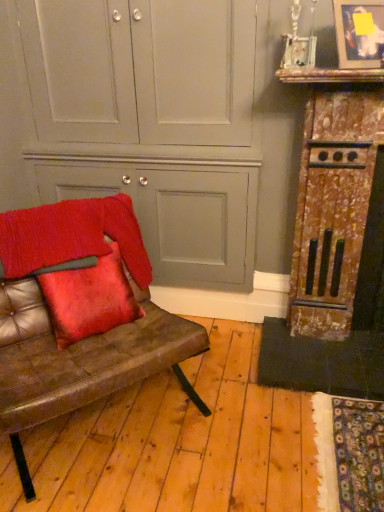
What do you see at coordinates (359, 33) in the screenshot? Image resolution: width=384 pixels, height=512 pixels. I see `metallic silver picture frame at upper right` at bounding box center [359, 33].

At what (x,y) coordinates should I click in order to perform the action: click on metallic silver picture frame at upper right. Please return your answer as a coordinate pair (x, y). Looking at the image, I should click on (359, 33).

The height and width of the screenshot is (512, 384). Describe the element at coordinates (79, 314) in the screenshot. I see `leather couch at left` at that location.

Find the location of a particular element. Image resolution: width=384 pixels, height=512 pixels. velvet red pillow at left is located at coordinates (89, 298).

How much space does rusty metal fireplace at right, which ranks as the second dresser in left-to-right order, occupy vertically?

rusty metal fireplace at right, which ranks as the second dresser in left-to-right order, is 3.92 feet tall.

This screenshot has height=512, width=384. In order to click on metallic silver picture frame at upper right in this screenshot , I will do `click(359, 33)`.

Between velvety red blanket at left and rusty metal fireplace at right, marked as the first dresser in a right-to-left arrangement, which one has more height?

Standing taller between the two is rusty metal fireplace at right, marked as the first dresser in a right-to-left arrangement.

Is velvety red blanket at left oriented towards rusty metal fireplace at right, which ranks as the second dresser in left-to-right order?

No, velvety red blanket at left does not turn towards rusty metal fireplace at right, which ranks as the second dresser in left-to-right order.

Does velvety red blanket at left come in front of rusty metal fireplace at right, marked as the first dresser in a right-to-left arrangement?

Yes, it is in front of rusty metal fireplace at right, marked as the first dresser in a right-to-left arrangement.

Who is taller, leather couch at left or velvety red blanket at left?

leather couch at left is taller.

From the image's perspective, is leather couch at left located above velvety red blanket at left?

Incorrect, from the image's perspective, leather couch at left is lower than velvety red blanket at left.

Consider the image. Relative to velvety red blanket at left, is leather couch at left in front or behind?

leather couch at left is in front of velvety red blanket at left.

Based on the photo, from a real-world perspective, is leather couch at left positioned above or below velvety red blanket at left?

From a real-world perspective, leather couch at left is physically below velvety red blanket at left.

Would you consider velvety red blanket at left to be distant from leather couch at left?

No.

From the image's perspective, is velvety red blanket at left above or below leather couch at left?

Based on their image positions, velvety red blanket at left is located above leather couch at left.

Is velvety red blanket at left turned away from leather couch at left?

Correct, velvety red blanket at left is looking away from leather couch at left.

Considering the positions of objects velvety red blanket at left and leather couch at left in the image provided, who is more to the left, velvety red blanket at left or leather couch at left?

velvety red blanket at left.

Are metallic silver picture frame at upper right and rusty metal fireplace at right, which ranks as the second dresser in left-to-right order, far apart?

They are positioned close to each other.

Can you confirm if metallic silver picture frame at upper right is taller than rusty metal fireplace at right, which ranks as the second dresser in left-to-right order?

In fact, metallic silver picture frame at upper right may be shorter than rusty metal fireplace at right, which ranks as the second dresser in left-to-right order.

From the image's perspective, is metallic silver picture frame at upper right over rusty metal fireplace at right, which ranks as the second dresser in left-to-right order?

Yes, from the image's perspective, metallic silver picture frame at upper right is above rusty metal fireplace at right, which ranks as the second dresser in left-to-right order.

Which object is wider, rusty metal fireplace at right, marked as the first dresser in a right-to-left arrangement, or leather couch at left?

Wider between the two is leather couch at left.

Based on the photo, is rusty metal fireplace at right, marked as the first dresser in a right-to-left arrangement, inside or outside of leather couch at left?

rusty metal fireplace at right, marked as the first dresser in a right-to-left arrangement, is spatially situated outside leather couch at left.

Looking at the image, does rusty metal fireplace at right, which ranks as the second dresser in left-to-right order, seem bigger or smaller compared to leather couch at left?

rusty metal fireplace at right, which ranks as the second dresser in left-to-right order, is smaller than leather couch at left.

The width and height of the screenshot is (384, 512). I want to click on studio couch below the rusty metal fireplace at right, which ranks as the second dresser in left-to-right order (from the image's perspective), so (79, 314).

Is metallic silver picture frame at upper right inside or outside of velvety red blanket at left?

metallic silver picture frame at upper right lies outside velvety red blanket at left.

You are a GUI agent. You are given a task and a screenshot of the screen. Output one action in this format:
    pyautogui.click(x=<x>, y=<y>)
    Task: Click on the picture frame above the velvety red blanket at left (from a real-world perspective)
    The image size is (384, 512).
    Given the screenshot: What is the action you would take?
    pyautogui.click(x=359, y=33)

Does point (382, 21) come behind point (130, 200)?

No.

Between matte gray cabinet at center, placed as the first dresser when sorted from left to right, and metallic silver picture frame at upper right, which one is positioned in front?

metallic silver picture frame at upper right is closer to the camera.

From a real-world perspective, between matte gray cabinet at center, placed as the first dresser when sorted from left to right, and metallic silver picture frame at upper right, who is vertically higher?

From a 3D spatial view, metallic silver picture frame at upper right is above.

Does matte gray cabinet at center, placed as the first dresser when sorted from left to right, have a greater width compared to metallic silver picture frame at upper right?

Yes.

Which is closer to the camera, (x=177, y=70) or (x=371, y=9)?

The point (x=371, y=9) is in front.

Where is `blanket below the rusty metal fireplace at right, marked as the first dresser in a right-to-left arrangement (from the image's perspective)`? The height and width of the screenshot is (512, 384). blanket below the rusty metal fireplace at right, marked as the first dresser in a right-to-left arrangement (from the image's perspective) is located at coordinates (72, 236).

This screenshot has height=512, width=384. In order to click on blanket that appears on the left of leather couch at left in this screenshot , I will do `click(72, 236)`.

Considering their positions, is metallic silver picture frame at upper right positioned closer to matte gray cabinet at center, which appears as the second dresser when viewed from the right, than velvet red pillow at left?

The object closer to matte gray cabinet at center, which appears as the second dresser when viewed from the right, is velvet red pillow at left.

Based on their spatial positions, is leather couch at left or metallic silver picture frame at upper right closer to rusty metal fireplace at right, which ranks as the second dresser in left-to-right order?

The object closer to rusty metal fireplace at right, which ranks as the second dresser in left-to-right order, is metallic silver picture frame at upper right.

Which object lies further to the anchor point metallic silver picture frame at upper right, rusty metal fireplace at right, which ranks as the second dresser in left-to-right order, or velvety red blanket at left?

The object further to metallic silver picture frame at upper right is velvety red blanket at left.

Based on the photo, considering their positions, is velvet red pillow at left positioned further to metallic silver picture frame at upper right than velvety red blanket at left?

Among the two, velvet red pillow at left is located further to metallic silver picture frame at upper right.

Considering their positions, is metallic silver picture frame at upper right positioned further to velvety red blanket at left than leather couch at left?

metallic silver picture frame at upper right is further to velvety red blanket at left.

Which object lies further to the anchor point matte gray cabinet at center, which appears as the second dresser when viewed from the right, velvet red pillow at left or rusty metal fireplace at right, marked as the first dresser in a right-to-left arrangement?

velvet red pillow at left is further to matte gray cabinet at center, which appears as the second dresser when viewed from the right.

Looking at the image, which one is located further to metallic silver picture frame at upper right, leather couch at left or velvety red blanket at left?

leather couch at left is further to metallic silver picture frame at upper right.

Estimate the real-world distances between objects in this image. Which object is closer to rusty metal fireplace at right, which ranks as the second dresser in left-to-right order, velvety red blanket at left or leather couch at left?

velvety red blanket at left lies closer to rusty metal fireplace at right, which ranks as the second dresser in left-to-right order, than the other object.

Where is `studio couch located between velvety red blanket at left and rusty metal fireplace at right, marked as the first dresser in a right-to-left arrangement, in the left-right direction`? The image size is (384, 512). studio couch located between velvety red blanket at left and rusty metal fireplace at right, marked as the first dresser in a right-to-left arrangement, in the left-right direction is located at coordinates (79, 314).

The height and width of the screenshot is (512, 384). Find the location of `blanket between matte gray cabinet at center, which appears as the second dresser when viewed from the right, and velvet red pillow at left in the up-down direction`. blanket between matte gray cabinet at center, which appears as the second dresser when viewed from the right, and velvet red pillow at left in the up-down direction is located at coordinates (72, 236).

The height and width of the screenshot is (512, 384). Find the location of `studio couch situated between velvety red blanket at left and metallic silver picture frame at upper right from left to right`. studio couch situated between velvety red blanket at left and metallic silver picture frame at upper right from left to right is located at coordinates (79, 314).

The width and height of the screenshot is (384, 512). I want to click on dresser located between velvety red blanket at left and rusty metal fireplace at right, marked as the first dresser in a right-to-left arrangement, in the left-right direction, so click(149, 122).